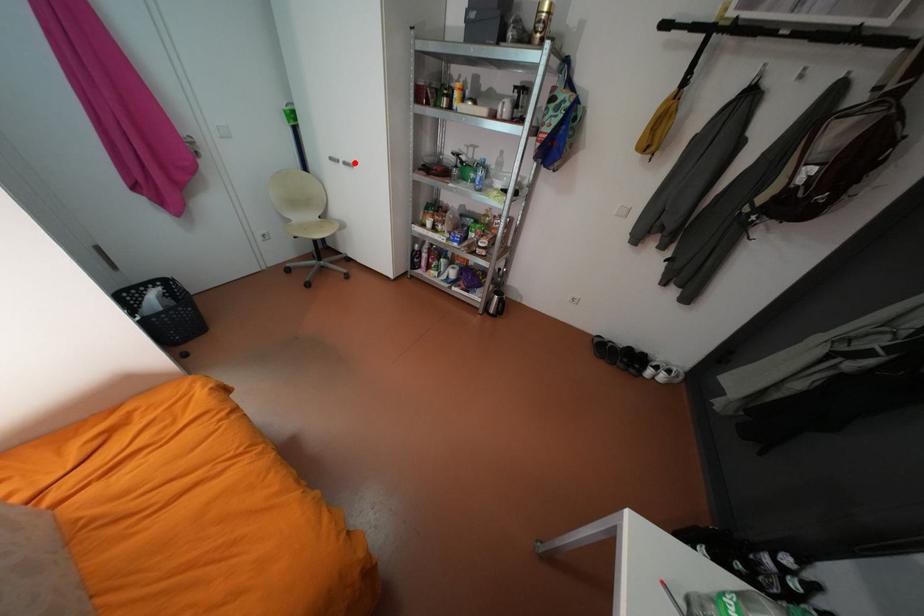
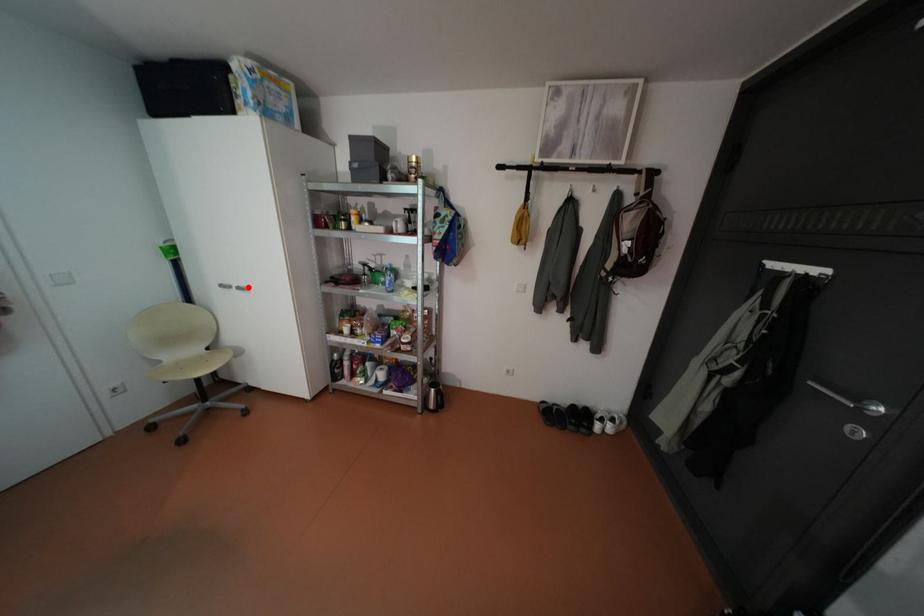
I am providing you with two images of the same scene from different viewpoints. A red point is marked on the first image and another point is marked on the second image. Is the red point in image1 aligned with the point shown in image2?

Yes